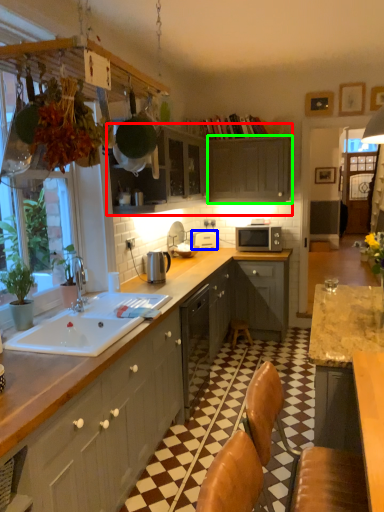
Question: Estimate the real-world distances between objects in this image. Which object is closer to cabinetry (highlighted by a red box), appliance (highlighted by a blue box) or cabinetry (highlighted by a green box)?

Choices:
 (A) appliance
 (B) cabinetry

Answer: (B)